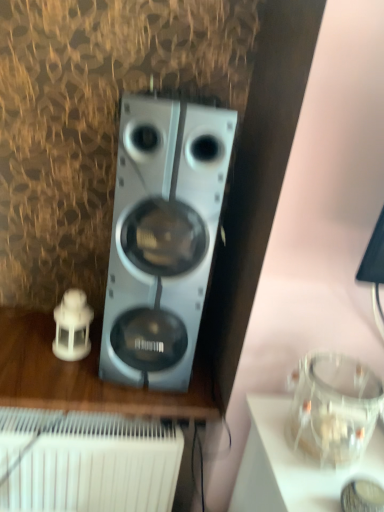
You are a GUI agent. You are given a task and a screenshot of the screen. Output one action in this format:
    pyautogui.click(x=<x>, y=<y>)
    Task: Click on the free space that is to the left of satin silver speaker at center
    
    Given the screenshot: What is the action you would take?
    (x=43, y=340)